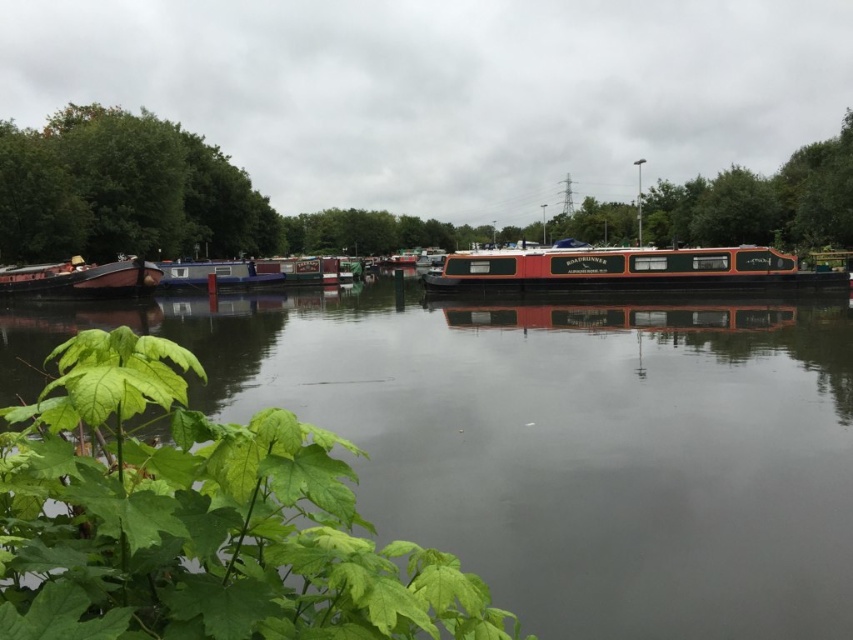
Question: Does wooden boat at left appear on the left side of matte brown houseboat at center?

Choices:
 (A) no
 (B) yes

Answer: (B)

Question: Which point is farther to the camera?

Choices:
 (A) (259, 259)
 (B) (215, 262)
 (C) (194, 150)
 (D) (74, 285)

Answer: (C)

Question: Can you confirm if green leafy tree at center is positioned above matte brown houseboat at center?

Choices:
 (A) yes
 (B) no

Answer: (A)

Question: Considering the real-world distances, which object is closest to the green leafy tree at left?

Choices:
 (A) green leafy tree at center
 (B) matte black houseboat at center

Answer: (A)

Question: Is smooth water at center bigger than wooden boat at left?

Choices:
 (A) yes
 (B) no

Answer: (A)

Question: Among these objects, which one is nearest to the camera?

Choices:
 (A) smooth water at center
 (B) green leafy tree at center
 (C) matte black houseboat at center
 (D) wooden boat at left

Answer: (A)